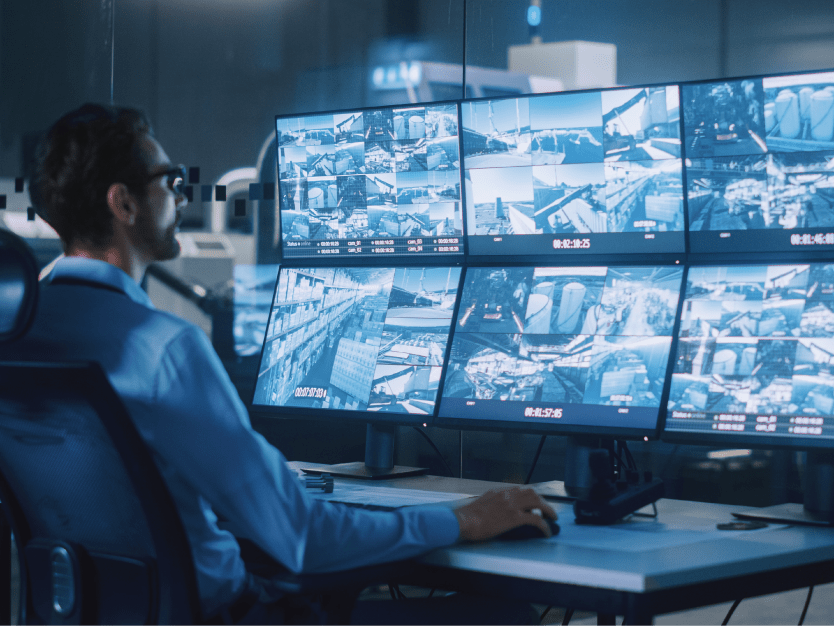
Image resolution: width=834 pixels, height=626 pixels. I want to click on monitor, so pos(378,195), pos(368,346), pos(569,172), pos(564,349), pos(780,173), pos(771,329).